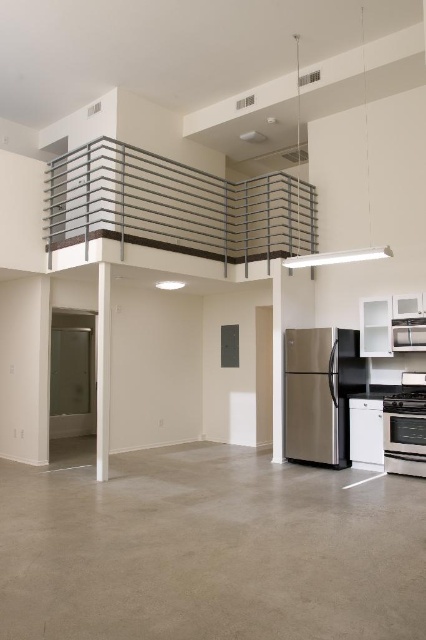
Looking at this image, who is lower down, metallic silver balustrade at upper center or stainless steel refrigerator at right?

stainless steel refrigerator at right is below.

This screenshot has width=426, height=640. What are the coordinates of `metallic silver balustrade at upper center` in the screenshot? It's located at (173, 205).

Can you confirm if stainless steel refrigerator at right is bigger than satin stainless steel oven at lower right?

Yes.

Is point (340, 384) positioned after point (422, 428)?

Yes, it is.

I want to click on stainless steel refrigerator at right, so click(x=319, y=394).

Can you confirm if metallic silver balustrade at upper center is positioned above satin stainless steel oven at lower right?

Correct, metallic silver balustrade at upper center is located above satin stainless steel oven at lower right.

Based on the photo, is metallic silver balustrade at upper center shorter than satin stainless steel oven at lower right?

Incorrect, metallic silver balustrade at upper center's height does not fall short of satin stainless steel oven at lower right's.

Locate an element on the screen. The height and width of the screenshot is (640, 426). metallic silver balustrade at upper center is located at coordinates (173, 205).

Image resolution: width=426 pixels, height=640 pixels. Identify the location of metallic silver balustrade at upper center. (173, 205).